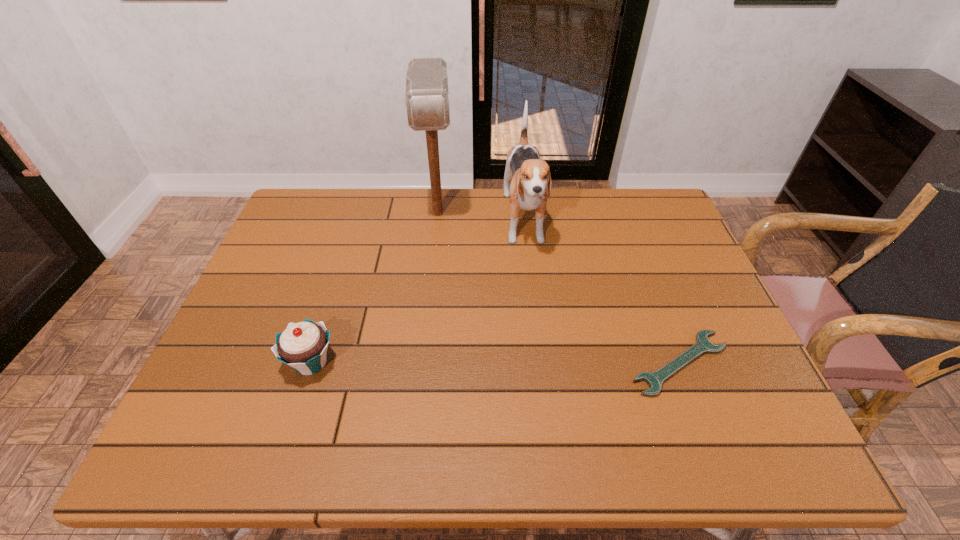
You are a GUI agent. You are given a task and a screenshot of the screen. Output one action in this format:
    pyautogui.click(x=<x>, y=<y>)
    Task: Click on the vacant space situated 0.320m at the face of the puppy
    The image size is (960, 540).
    Given the screenshot: What is the action you would take?
    pyautogui.click(x=542, y=359)

This screenshot has width=960, height=540. Find the location of `free space located 0.370m at the face of the puppy`. free space located 0.370m at the face of the puppy is located at coordinates (545, 377).

Locate an element on the screen. vacant area located 0.120m at the face of the puppy is located at coordinates (533, 295).

Where is `vacant area situated above the head of the mallet`? This screenshot has width=960, height=540. vacant area situated above the head of the mallet is located at coordinates (437, 251).

Identify the location of vacant area situated above the head of the mallet. (438, 262).

What are the coordinates of `free region located 0.170m above the head of the mallet` in the screenshot? It's located at (438, 274).

At what (x,y) coordinates should I click in order to perform the action: click on puppy that is positioned at the far edge. Please return your answer as a coordinate pair (x, y). The image size is (960, 540). Looking at the image, I should click on (530, 176).

Where is `mallet present at the far edge`? mallet present at the far edge is located at coordinates (427, 97).

This screenshot has height=540, width=960. In order to click on cupcake located at the near edge in this screenshot , I will do [303, 346].

Where is `wrench located at the near edge`? The width and height of the screenshot is (960, 540). wrench located at the near edge is located at coordinates (702, 345).